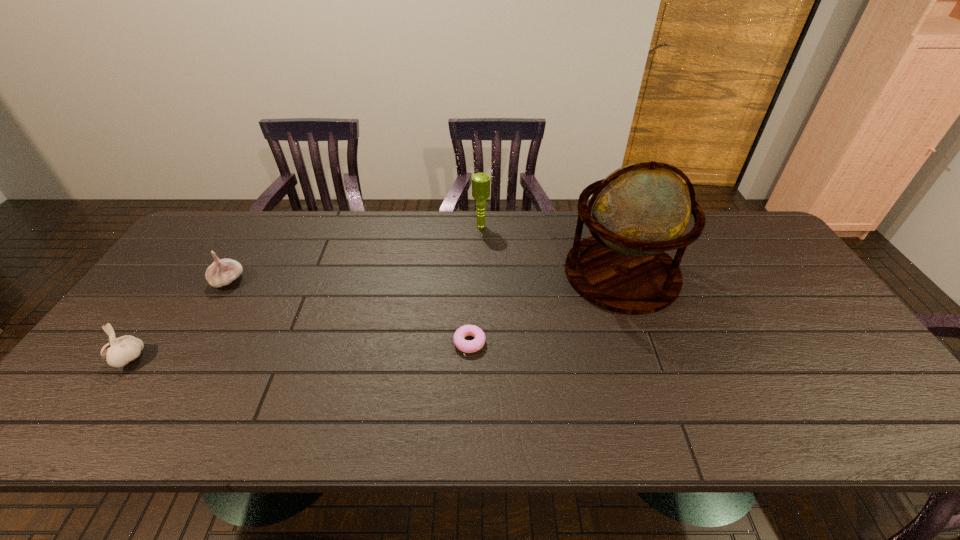
Locate an element on the screen. The height and width of the screenshot is (540, 960). vacant area at the right edge of the desktop is located at coordinates (793, 313).

Where is `vacant region at the far left corner of the desktop`? The width and height of the screenshot is (960, 540). vacant region at the far left corner of the desktop is located at coordinates (209, 245).

In the image, there is a desktop. Where is `blank space at the far right corner`? The image size is (960, 540). blank space at the far right corner is located at coordinates (710, 217).

The height and width of the screenshot is (540, 960). What are the coordinates of `vacant area that lies between the doughnut and the farther garlic` in the screenshot? It's located at [x=348, y=312].

This screenshot has height=540, width=960. In order to click on empty space between the fourth shortest object and the fourth object from right to left in this screenshot , I will do `click(354, 253)`.

Identify the location of free spot between the leftmost object and the rightmost object. (374, 316).

Find the location of a particular element. The height and width of the screenshot is (540, 960). vacant point located between the microphone and the doughnut is located at coordinates (475, 285).

Find the location of `free space between the left garlic and the doughnut`. free space between the left garlic and the doughnut is located at coordinates (299, 350).

Identify the location of vacant point located between the tallest object and the farthest object. Image resolution: width=960 pixels, height=540 pixels. (551, 250).

Where is `free space between the nearer garlic and the shortest object`? free space between the nearer garlic and the shortest object is located at coordinates (299, 350).